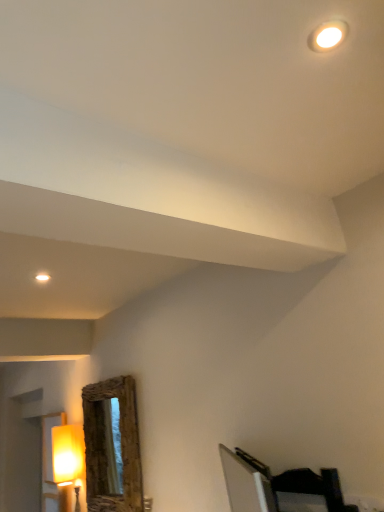
Question: Would you say rustic wood mirror at lower left is inside or outside dark wood bed at lower right?

Choices:
 (A) outside
 (B) inside

Answer: (A)

Question: In terms of width, does rustic wood mirror at lower left look wider or thinner when compared to dark wood bed at lower right?

Choices:
 (A) thin
 (B) wide

Answer: (B)

Question: Estimate the real-world distances between objects in this image. Which object is closer to the dark wood bed at lower right?

Choices:
 (A) rustic wood mirror at lower left
 (B) matte yellow lampshade at left

Answer: (A)

Question: Based on their relative distances, which object is farther from the matte yellow lampshade at left?

Choices:
 (A) dark wood bed at lower right
 (B) rustic wood mirror at lower left

Answer: (A)